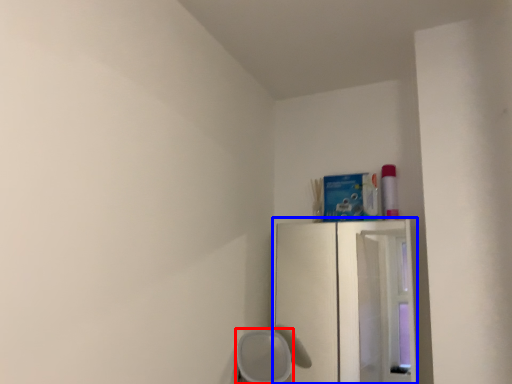
Question: Which point is further to the camera, furniture (highlighted by a red box) or fridge (highlighted by a blue box)?

Choices:
 (A) furniture
 (B) fridge

Answer: (B)